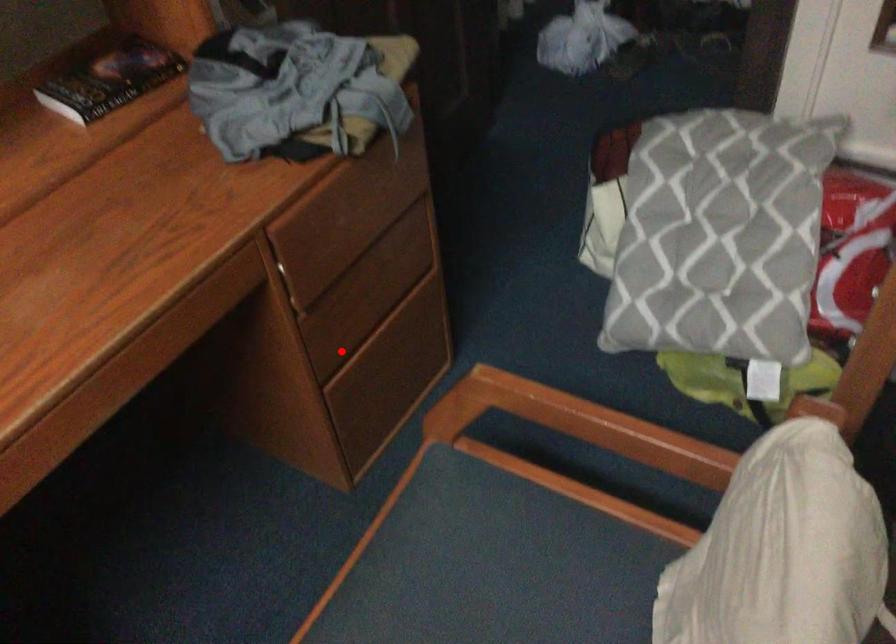
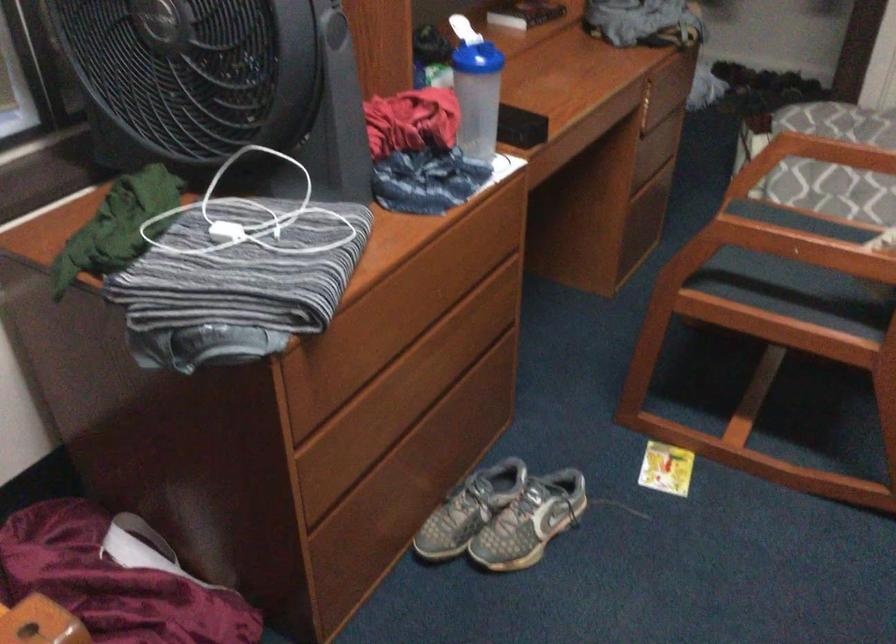
Question: I am providing you with two images of the same scene from different viewpoints. A red point is marked on the first image. Is the red point's position out of view in image 2?

Choices:
 (A) Yes
 (B) No

Answer: (B)